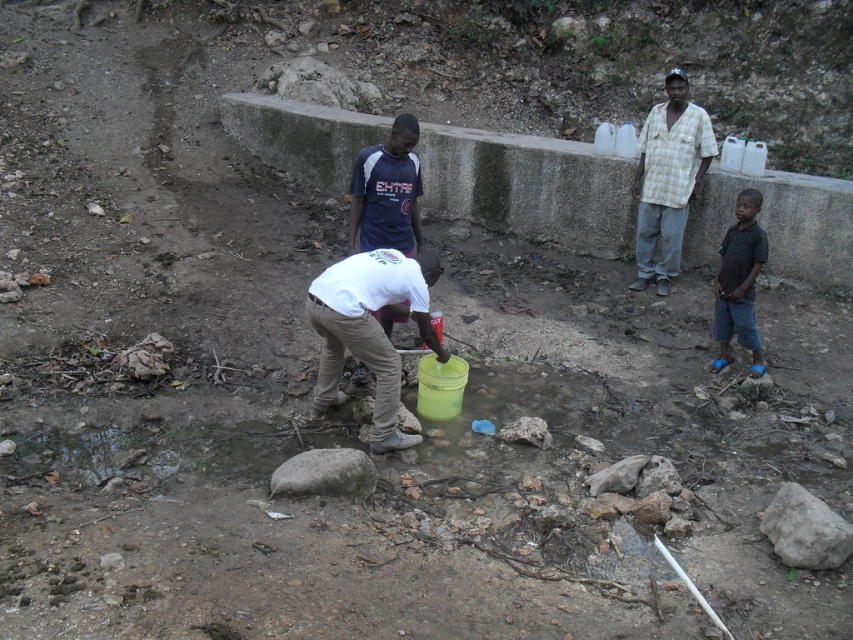
Can you confirm if white matte shirt at center is taller than white cotton shirt at center?

Correct, white matte shirt at center is much taller as white cotton shirt at center.

Is white matte shirt at center further to camera compared to white cotton shirt at center?

No, white matte shirt at center is closer to the viewer.

Find the location of a particular element. white matte shirt at center is located at coordinates (370, 330).

Who is taller, white matte shirt at center or checkered shirt at upper right?

checkered shirt at upper right

Is white matte shirt at center wider than checkered shirt at upper right?

Yes.

Who is more distant from viewer, (328, 301) or (641, 212)?

Positioned behind is point (641, 212).

Locate an element on the screen. The image size is (853, 640). white matte shirt at center is located at coordinates (370, 330).

The image size is (853, 640). What do you see at coordinates (370, 330) in the screenshot?
I see `white matte shirt at center` at bounding box center [370, 330].

Is white matte shirt at center positioned in front of dark blue shirt at right?

That is True.

The image size is (853, 640). What do you see at coordinates (370, 330) in the screenshot? I see `white matte shirt at center` at bounding box center [370, 330].

Where is `white matte shirt at center`? The image size is (853, 640). white matte shirt at center is located at coordinates (370, 330).